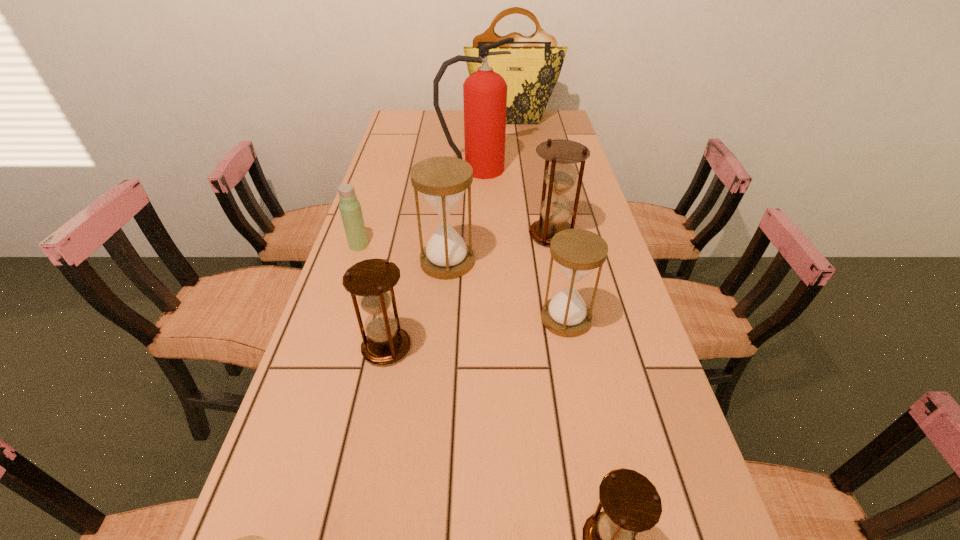
The image size is (960, 540). I want to click on hourglass that is at the left edge, so click(372, 280).

The width and height of the screenshot is (960, 540). I want to click on thermos bottle present at the left edge, so click(x=350, y=208).

Identify the location of tote bag that is at the right edge. The image size is (960, 540). (531, 71).

Locate an element on the screen. This screenshot has width=960, height=540. object that is at the far right corner is located at coordinates (531, 71).

Identify the location of free space at the far edge of the desktop. This screenshot has width=960, height=540. (454, 131).

In the image, there is a desktop. Where is `vacant space at the left edge`? This screenshot has height=540, width=960. vacant space at the left edge is located at coordinates (379, 168).

At what (x,y) coordinates should I click in order to perform the action: click on vacant space at the right edge. Please return your answer as a coordinate pair (x, y). This screenshot has width=960, height=540. Looking at the image, I should click on (x=541, y=160).

The image size is (960, 540). Identify the location of empty space that is in between the light thermos bottle and the biggest white hourglass. (403, 254).

Locate an element on the screen. This screenshot has width=960, height=540. empty space between the second white hourglass from right to left and the thermos bottle is located at coordinates (403, 254).

Identify which object is located as the seventh nearest to the fire extinguisher. Please provide its 2D coordinates. Your answer should be formatted as a tuple, i.e. [(x, y)], where the tuple contains the x and y coordinates of a point satisfying the conditions above.

[(631, 503)]